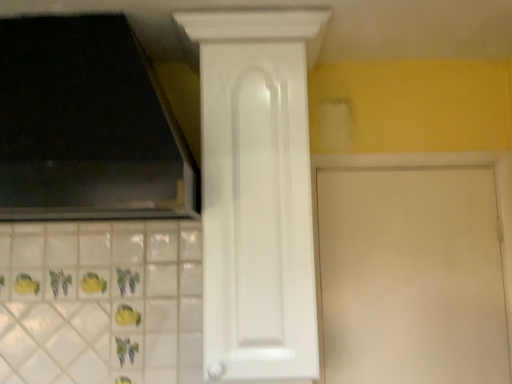
Image resolution: width=512 pixels, height=384 pixels. I want to click on white glossy cabinet door at center, the 1th door in the left-to-right sequence, so click(x=257, y=192).

What do you see at coordinates (257, 192) in the screenshot? The image size is (512, 384). I see `white glossy cabinet door at center, the 1th door in the left-to-right sequence` at bounding box center [257, 192].

What do you see at coordinates (411, 276) in the screenshot? The width and height of the screenshot is (512, 384). I see `white matte door at center, the first door positioned from the right` at bounding box center [411, 276].

This screenshot has height=384, width=512. In order to click on white matte door at center, positioned as the 2th door in left-to-right order in this screenshot , I will do `click(411, 276)`.

Image resolution: width=512 pixels, height=384 pixels. In order to click on white glossy cabinet door at center, the 1th door in the left-to-right sequence in this screenshot , I will do `click(257, 192)`.

Considering the positions of objects white glossy cabinet door at center, the 1th door in the left-to-right sequence, and white matte door at center, the first door positioned from the right, in the image provided, who is more to the right, white glossy cabinet door at center, the 1th door in the left-to-right sequence, or white matte door at center, the first door positioned from the right,?

white matte door at center, the first door positioned from the right, is more to the right.

Which object is closer to the camera, white glossy cabinet door at center, the 1th door in the left-to-right sequence, or white matte door at center, the first door positioned from the right?

white glossy cabinet door at center, the 1th door in the left-to-right sequence.

Is point (297, 132) behind point (495, 361)?

No, (297, 132) is in front of (495, 361).

From the image's perspective, is white glossy cabinet door at center, the 1th door in the left-to-right sequence, located beneath white matte door at center, the first door positioned from the right?

No, from the image's perspective, white glossy cabinet door at center, the 1th door in the left-to-right sequence, is not beneath white matte door at center, the first door positioned from the right.

From a real-world perspective, relative to white matte door at center, positioned as the 2th door in left-to-right order, is white glossy cabinet door at center, marked as the second door in a right-to-left arrangement, vertically above or below?

From a real-world perspective, white glossy cabinet door at center, marked as the second door in a right-to-left arrangement, is physically above white matte door at center, positioned as the 2th door in left-to-right order.

Considering the relative sizes of white glossy cabinet door at center, the 1th door in the left-to-right sequence, and white matte door at center, the first door positioned from the right, in the image provided, is white glossy cabinet door at center, the 1th door in the left-to-right sequence, thinner than white matte door at center, the first door positioned from the right,?

No.

Based on the photo, which of these two, white glossy cabinet door at center, marked as the second door in a right-to-left arrangement, or white matte door at center, the first door positioned from the right, stands shorter?

Standing shorter between the two is white matte door at center, the first door positioned from the right.

Who is smaller, white glossy cabinet door at center, the 1th door in the left-to-right sequence, or white matte door at center, positioned as the 2th door in left-to-right order?

white matte door at center, positioned as the 2th door in left-to-right order.

Can we say white glossy cabinet door at center, marked as the second door in a right-to-left arrangement, lies outside white matte door at center, the first door positioned from the right?

Yes, white glossy cabinet door at center, marked as the second door in a right-to-left arrangement, is outside of white matte door at center, the first door positioned from the right.

Is white glossy cabinet door at center, marked as the second door in a right-to-left arrangement, in contact with white matte door at center, positioned as the 2th door in left-to-right order?

No, white glossy cabinet door at center, marked as the second door in a right-to-left arrangement, is not with white matte door at center, positioned as the 2th door in left-to-right order.

Does white glossy cabinet door at center, marked as the second door in a right-to-left arrangement, turn towards white matte door at center, the first door positioned from the right?

No, white glossy cabinet door at center, marked as the second door in a right-to-left arrangement, is not turned towards white matte door at center, the first door positioned from the right.

Image resolution: width=512 pixels, height=384 pixels. I want to click on door on the right of white glossy cabinet door at center, marked as the second door in a right-to-left arrangement, so click(411, 276).

Considering the positions of objects white matte door at center, positioned as the 2th door in left-to-right order, and white glossy cabinet door at center, marked as the second door in a right-to-left arrangement, in the image provided, who is more to the right, white matte door at center, positioned as the 2th door in left-to-right order, or white glossy cabinet door at center, marked as the second door in a right-to-left arrangement,?

From the viewer's perspective, white matte door at center, positioned as the 2th door in left-to-right order, appears more on the right side.

Considering their positions, is white matte door at center, positioned as the 2th door in left-to-right order, located in front of or behind white glossy cabinet door at center, marked as the second door in a right-to-left arrangement?

Clearly, white matte door at center, positioned as the 2th door in left-to-right order, is behind white glossy cabinet door at center, marked as the second door in a right-to-left arrangement.

Which is behind, point (328, 328) or point (297, 319)?

The point (328, 328) is behind.

Looking at this image, from the image's perspective, between white matte door at center, positioned as the 2th door in left-to-right order, and white glossy cabinet door at center, marked as the second door in a right-to-left arrangement, which one is located above?

From the image's view, white glossy cabinet door at center, marked as the second door in a right-to-left arrangement, is above.

From a real-world perspective, is white matte door at center, the first door positioned from the right, physically located above or below white glossy cabinet door at center, the 1th door in the left-to-right sequence?

Clearly, from a real-world perspective, white matte door at center, the first door positioned from the right, is below white glossy cabinet door at center, the 1th door in the left-to-right sequence.

Does white matte door at center, the first door positioned from the right, have a lesser width compared to white glossy cabinet door at center, marked as the second door in a right-to-left arrangement?

Correct, the width of white matte door at center, the first door positioned from the right, is less than that of white glossy cabinet door at center, marked as the second door in a right-to-left arrangement.

Is white matte door at center, the first door positioned from the right, shorter than white glossy cabinet door at center, the 1th door in the left-to-right sequence?

Yes.

Considering the relative sizes of white matte door at center, the first door positioned from the right, and white glossy cabinet door at center, the 1th door in the left-to-right sequence, in the image provided, is white matte door at center, the first door positioned from the right, bigger than white glossy cabinet door at center, the 1th door in the left-to-right sequence,?

No, white matte door at center, the first door positioned from the right, is not bigger than white glossy cabinet door at center, the 1th door in the left-to-right sequence.

Is white matte door at center, positioned as the 2th door in left-to-right order, outside of white glossy cabinet door at center, marked as the second door in a right-to-left arrangement?

Yes, white matte door at center, positioned as the 2th door in left-to-right order, is outside of white glossy cabinet door at center, marked as the second door in a right-to-left arrangement.

Are white matte door at center, positioned as the 2th door in left-to-right order, and white glossy cabinet door at center, marked as the second door in a right-to-left arrangement, far apart?

No, there isn't a large distance between white matte door at center, positioned as the 2th door in left-to-right order, and white glossy cabinet door at center, marked as the second door in a right-to-left arrangement.

Could you tell me if white matte door at center, positioned as the 2th door in left-to-right order, is turned towards white glossy cabinet door at center, the 1th door in the left-to-right sequence?

No, white matte door at center, positioned as the 2th door in left-to-right order, does not turn towards white glossy cabinet door at center, the 1th door in the left-to-right sequence.

Can you tell me how much white matte door at center, the first door positioned from the right, and white glossy cabinet door at center, marked as the second door in a right-to-left arrangement, differ in facing direction?

The angle between the facing direction of white matte door at center, the first door positioned from the right, and the facing direction of white glossy cabinet door at center, marked as the second door in a right-to-left arrangement, is 0.347 degrees.

How much distance is there between white matte door at center, the first door positioned from the right, and white glossy cabinet door at center, the 1th door in the left-to-right sequence?

white matte door at center, the first door positioned from the right, and white glossy cabinet door at center, the 1th door in the left-to-right sequence, are 19.03 inches apart.

The height and width of the screenshot is (384, 512). I want to click on door beneath the white glossy cabinet door at center, marked as the second door in a right-to-left arrangement (from a real-world perspective), so click(x=411, y=276).

Identify the location of door on the left side of white matte door at center, the first door positioned from the right. (257, 192).

You are a GUI agent. You are given a task and a screenshot of the screen. Output one action in this format:
    pyautogui.click(x=<x>, y=<y>)
    Task: Click on the door below the white glossy cabinet door at center, the 1th door in the left-to-right sequence (from a real-world perspective)
    The width and height of the screenshot is (512, 384).
    Given the screenshot: What is the action you would take?
    pyautogui.click(x=411, y=276)